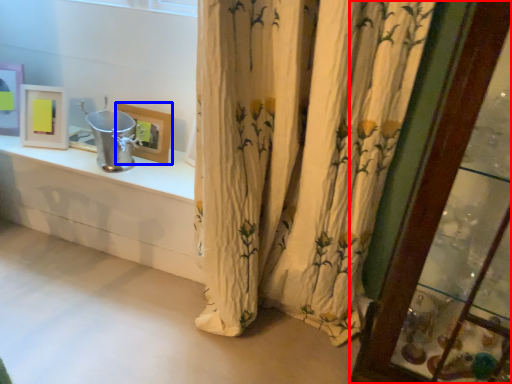
Question: Which point is further to the camera, glass door (highlighted by a red box) or picture frame (highlighted by a blue box)?

Choices:
 (A) glass door
 (B) picture frame

Answer: (B)